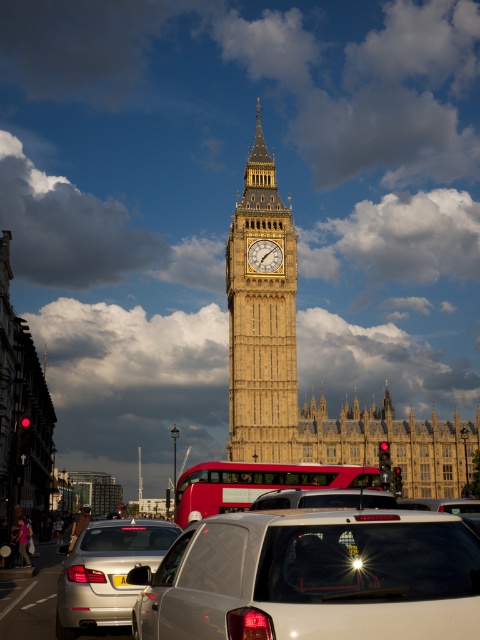
You are a pedestrian standing at the intersection near Big Ben. You see a silver metallic sedan at lower left and a silver metallic suv at center. Which vehicle is taller?

The silver metallic sedan at lower left is much taller than the silver metallic suv at center.

You are a tourist standing at the intersection near Big Ben. You see two points marked on the ground ahead of you. The first point is at coordinates point (348, 586) and the second is at point (132, 528). If you were to walk towards the second point, would you pass by the first point before reaching it?

No, because point (348, 586) is in front of point (132, 528). When moving towards the second point, you would encounter the first point after passing the second one.